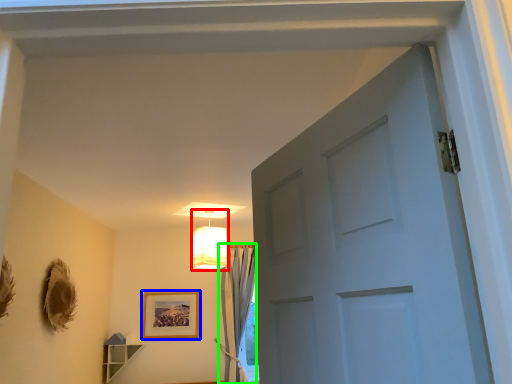
Question: Based on their relative distances, which object is farther from lamp (highlighted by a red box)? Choose from picture frame (highlighted by a blue box) and curtain (highlighted by a green box).

Choices:
 (A) picture frame
 (B) curtain

Answer: (A)